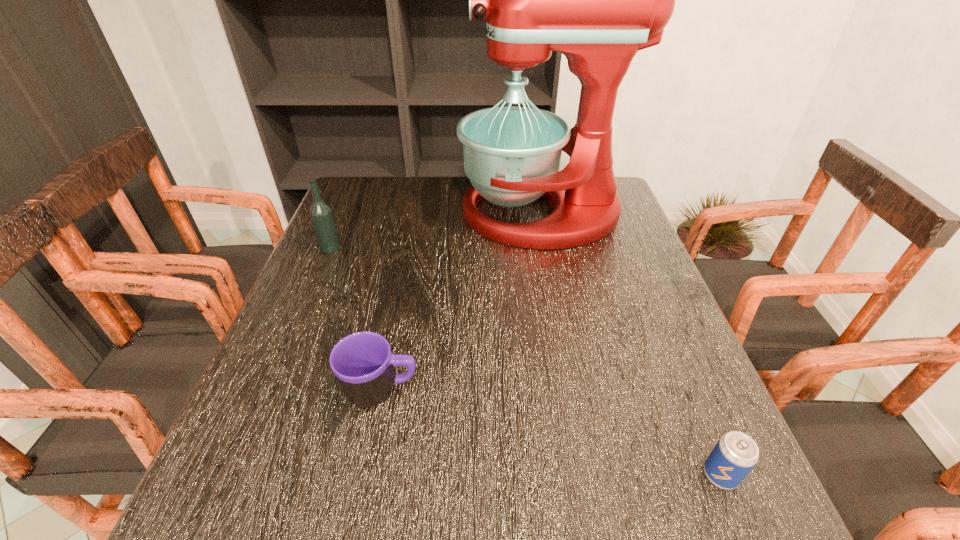
Image resolution: width=960 pixels, height=540 pixels. I want to click on vacant position in the image that satisfies the following two spatial constraints: 1. on the front side of the nearest object; 2. on the right side of the leftmost object, so click(235, 475).